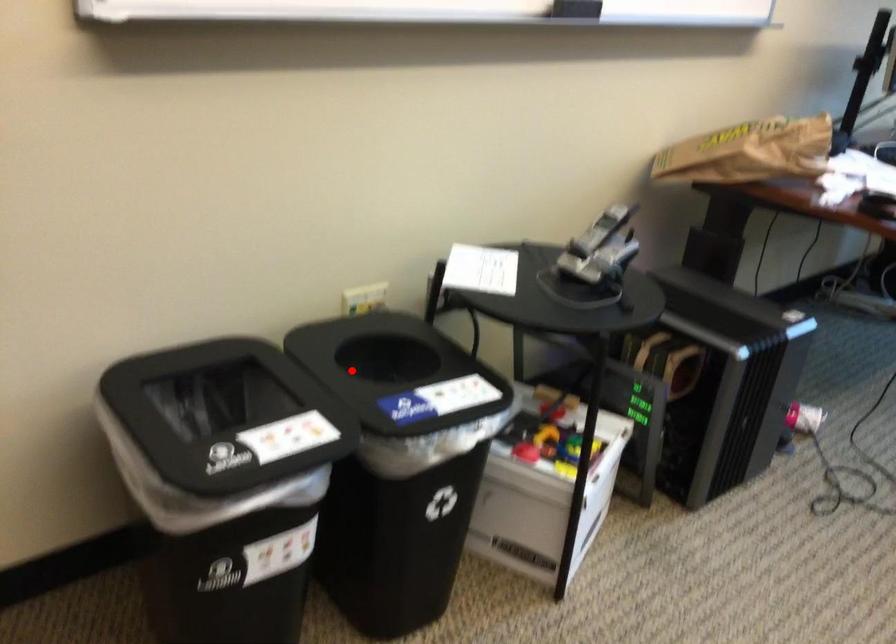
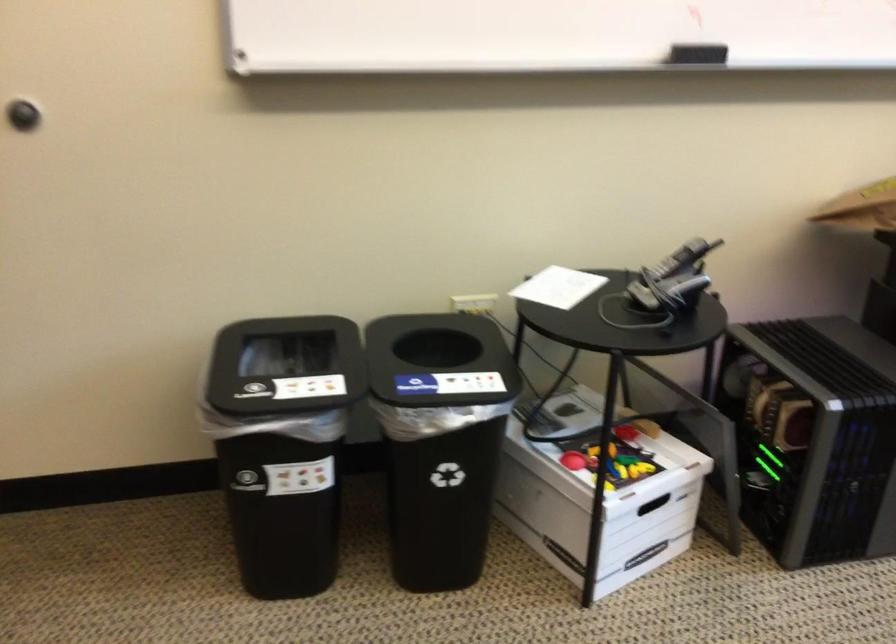
Question: I am providing you with two images of the same scene from different viewpoints. A red point is shown in image1. For the corresponding object point in image2, is it positioned nearer or farther from the camera?

Choices:
 (A) Nearer
 (B) Farther

Answer: (B)